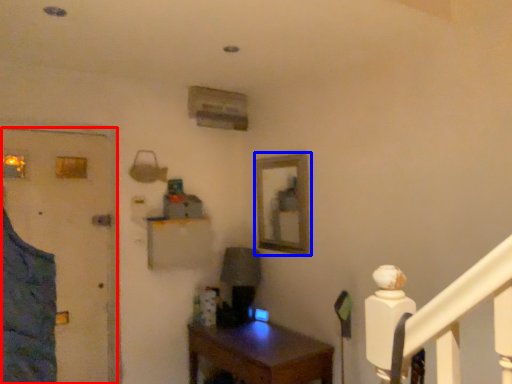
Question: Which point is closer to the camera, door (highlighted by a red box) or picture frame (highlighted by a blue box)?

Choices:
 (A) door
 (B) picture frame

Answer: (A)